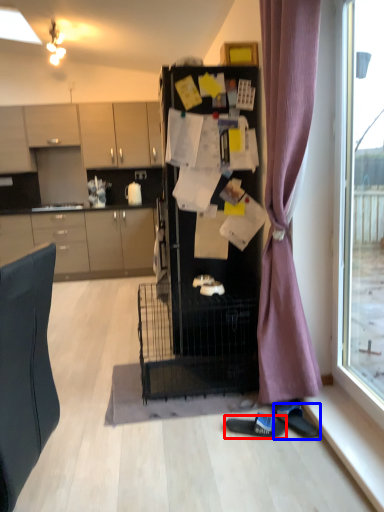
Question: Which object appears farthest to the camera in this image, footwear (highlighted by a red box) or footwear (highlighted by a blue box)?

Choices:
 (A) footwear
 (B) footwear

Answer: (A)